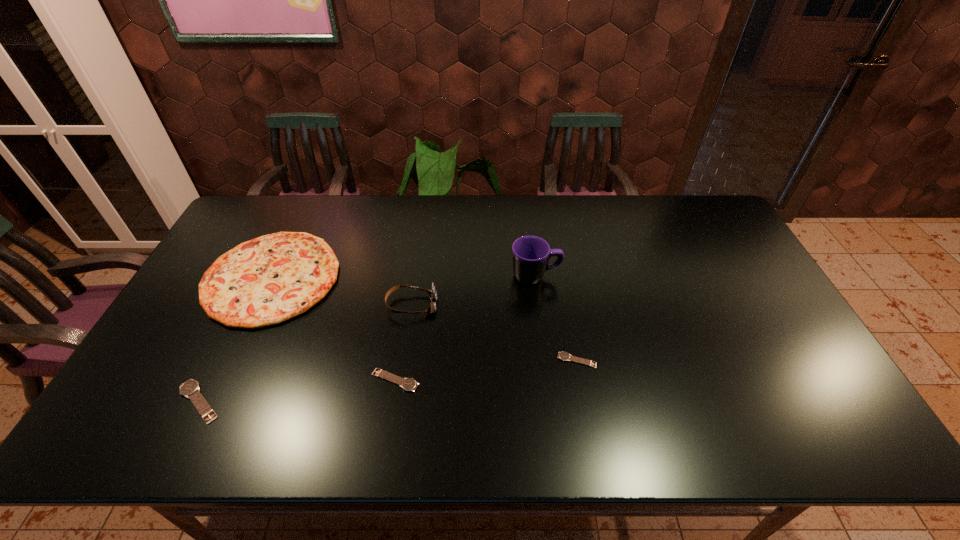
At what (x,y) coordinates should I click in order to perform the action: click on vacant space at the far edge of the desktop. Please return your answer as a coordinate pair (x, y). The image size is (960, 540). Looking at the image, I should click on (536, 219).

The height and width of the screenshot is (540, 960). What are the coordinates of `vacant space at the near edge` in the screenshot? It's located at (731, 388).

The width and height of the screenshot is (960, 540). Find the location of `vacant region at the near left corner of the desktop`. vacant region at the near left corner of the desktop is located at coordinates (151, 396).

The width and height of the screenshot is (960, 540). Identify the location of vacant space at the far right corner. (701, 195).

The height and width of the screenshot is (540, 960). Identify the location of vacant space at the near right corner of the desktop. (798, 383).

Find the location of a particular element. This screenshot has width=960, height=540. vacant region between the tallest object and the fifth shortest object is located at coordinates (473, 290).

This screenshot has height=540, width=960. In order to click on vacant space in between the pizza and the second watch from right to left in this screenshot , I will do `click(333, 329)`.

Where is `free space between the second watch from right to left and the fourth tallest object`? This screenshot has height=540, width=960. free space between the second watch from right to left and the fourth tallest object is located at coordinates (297, 391).

You are a GUI agent. You are given a task and a screenshot of the screen. Output one action in this format:
    pyautogui.click(x=<x>, y=<y>)
    Task: Click on the unoccupied area between the fourth shortest object and the goggles
    Image resolution: width=960 pixels, height=540 pixels.
    Given the screenshot: What is the action you would take?
    pyautogui.click(x=342, y=292)

Where is `vacant area that lies between the tallest object and the pizza`? The width and height of the screenshot is (960, 540). vacant area that lies between the tallest object and the pizza is located at coordinates (403, 277).